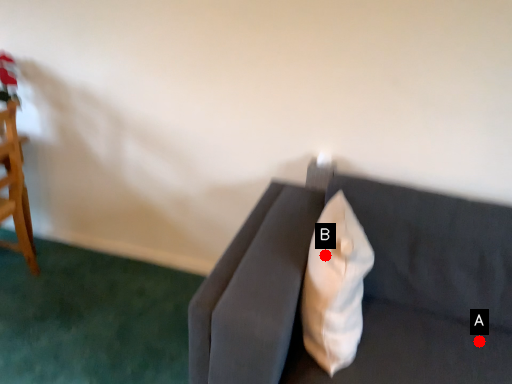
Question: Two points are circled on the image, labeled by A and B beside each circle. Which point appears closest to the camera in this image?

Choices:
 (A) A is closer
 (B) B is closer

Answer: (B)